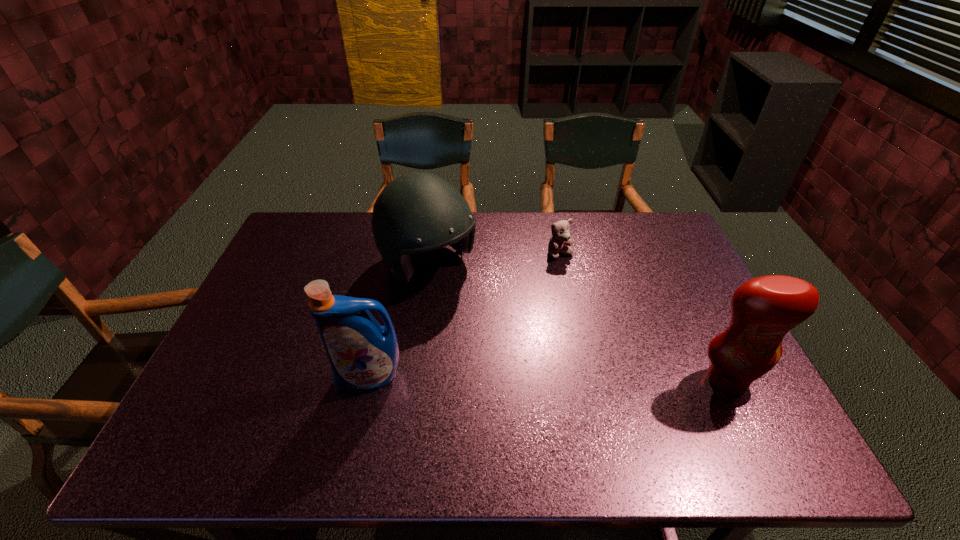
At what (x,y) coordinates should I click in order to perform the action: click on vacant space at the right edge of the desktop. Please return your answer as a coordinate pair (x, y). This screenshot has width=960, height=540. Looking at the image, I should click on (702, 289).

Where is `free space at the far left corner of the desktop`? The height and width of the screenshot is (540, 960). free space at the far left corner of the desktop is located at coordinates (283, 238).

Where is `free space at the far right corner of the desktop`? free space at the far right corner of the desktop is located at coordinates (637, 237).

Find the location of a particular element. Image resolution: width=960 pixels, height=540 pixels. free space between the football helmet and the shortest object is located at coordinates (494, 260).

At what (x,y) coordinates should I click in order to perform the action: click on empty space that is in between the detergent and the football helmet. Please return your answer as a coordinate pair (x, y). Looking at the image, I should click on (398, 322).

Locate an element on the screen. unoccupied position between the detergent and the condiment is located at coordinates (548, 379).

Identify the location of vacant region between the rightmost object and the detergent. (548, 379).

Where is `vacant area that lies between the rightmost object and the detergent`? This screenshot has width=960, height=540. vacant area that lies between the rightmost object and the detergent is located at coordinates (548, 379).

Locate an element on the screen. blank region between the football helmet and the detergent is located at coordinates (398, 322).

At what (x,y) coordinates should I click in order to perform the action: click on free space between the football helmet and the rightmost object. Please return your answer as a coordinate pair (x, y). The width and height of the screenshot is (960, 540). Looking at the image, I should click on (577, 323).